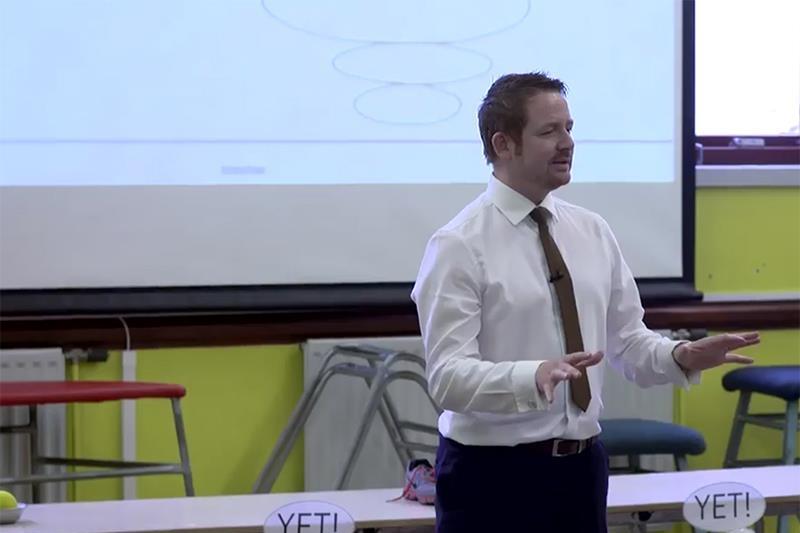
You are a GUI agent. You are given a task and a screenshot of the screen. Output one action in this format:
    pyautogui.click(x=<x>, y=<y>)
    Task: Click on the stools to sit on
    The height and width of the screenshot is (533, 800).
    Given the screenshot: What is the action you would take?
    pyautogui.click(x=770, y=376), pyautogui.click(x=637, y=438)